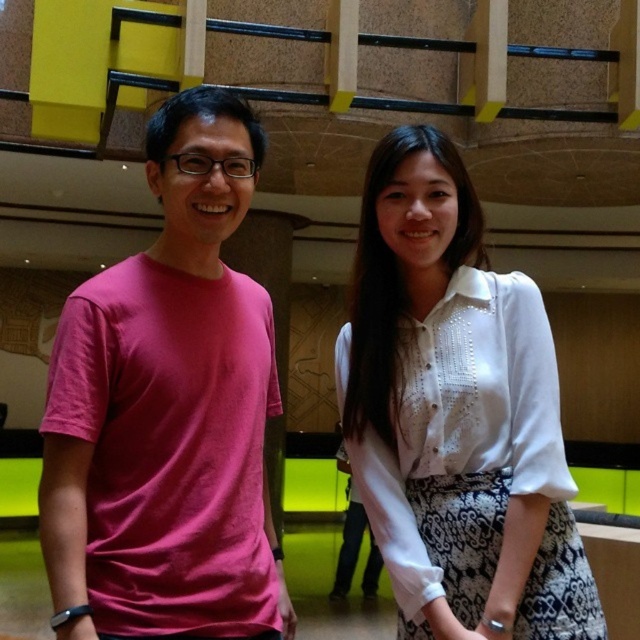
Does pink matte t-shirt at left appear on the left side of white textured blouse at center?

Correct, you'll find pink matte t-shirt at left to the left of white textured blouse at center.

Does pink matte t-shirt at left have a larger size compared to white textured blouse at center?

Indeed, pink matte t-shirt at left has a larger size compared to white textured blouse at center.

The height and width of the screenshot is (640, 640). I want to click on pink matte t-shirt at left, so click(x=168, y=410).

Locate an element on the screen. This screenshot has width=640, height=640. pink matte t-shirt at left is located at coordinates (168, 410).